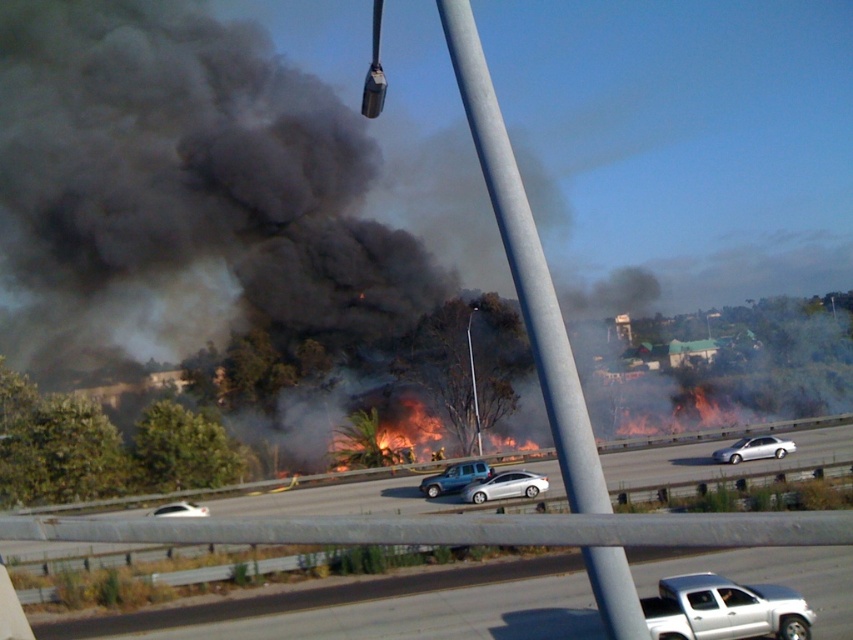
Does smooth asphalt highway at center appear under brushed metal pole at center?

Yes, smooth asphalt highway at center is below brushed metal pole at center.

Based on the photo, can you confirm if smooth asphalt highway at center is positioned to the right of brushed metal pole at center?

Yes, smooth asphalt highway at center is to the right of brushed metal pole at center.

Find the location of a particular element. smooth asphalt highway at center is located at coordinates (708, 452).

Does point (466, 324) come closer to viewer compared to point (169, 513)?

No, it is behind (169, 513).

Can you confirm if brushed metal pole at center is positioned to the right of white matte car at lower left?

Indeed, brushed metal pole at center is positioned on the right side of white matte car at lower left.

Measure the distance between point (469, 348) and camera.

51.78 meters

Where is `brushed metal pole at center`? The height and width of the screenshot is (640, 853). brushed metal pole at center is located at coordinates (473, 380).

In the scene shown: Does metallic gray pole at center have a greater height compared to smooth asphalt highway at center?

Yes, metallic gray pole at center is taller than smooth asphalt highway at center.

Between metallic gray pole at center and smooth asphalt highway at center, which one has less height?

smooth asphalt highway at center is shorter.

The height and width of the screenshot is (640, 853). I want to click on metallic gray pole at center, so click(x=526, y=266).

This screenshot has height=640, width=853. I want to click on metallic gray pole at center, so click(526, 266).